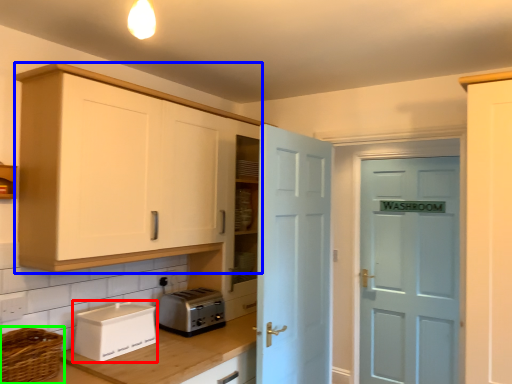
Question: Which is nearer to the appliance (highlighted by a red box)? cabinetry (highlighted by a blue box) or basket (highlighted by a green box).

Choices:
 (A) cabinetry
 (B) basket

Answer: (B)